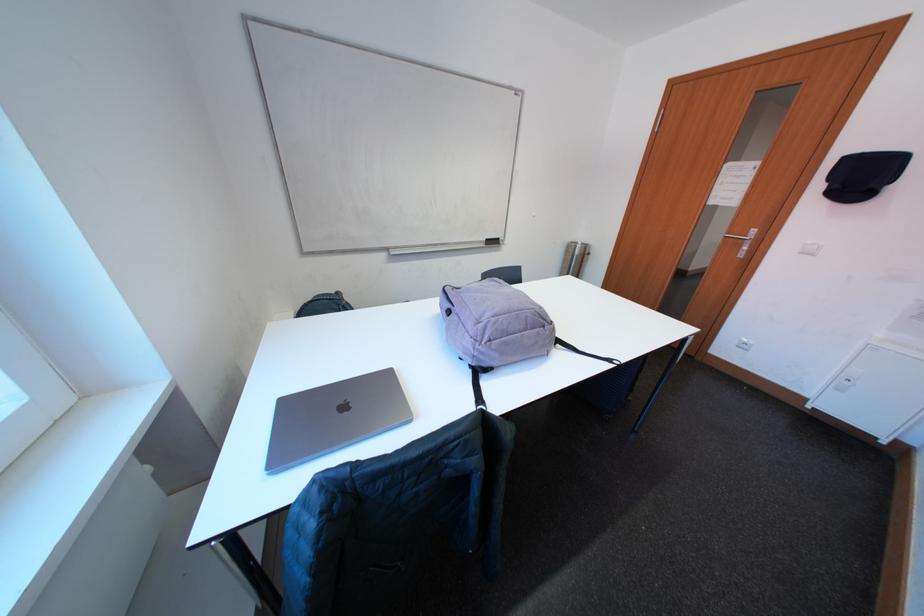
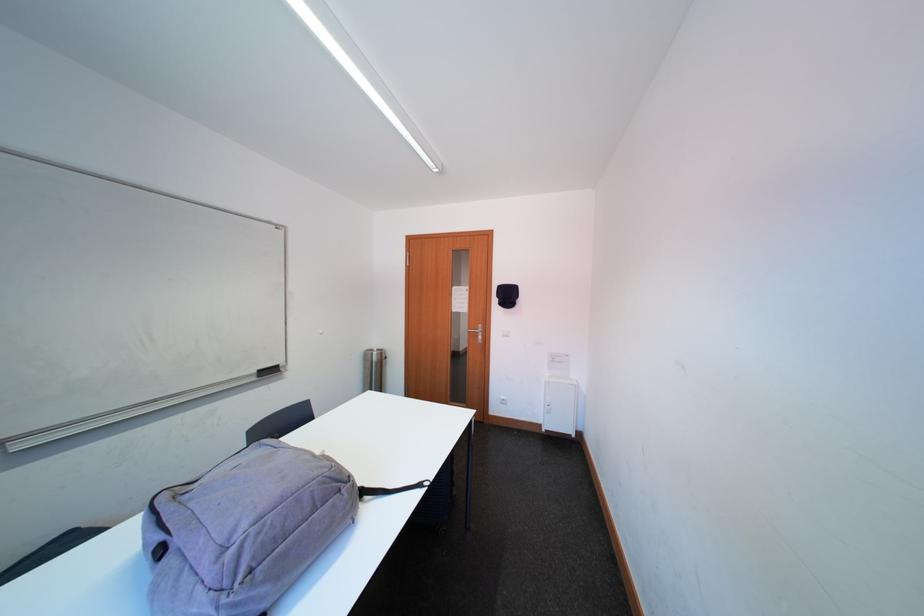
Question: The images are taken continuously from a first-person perspective. In which direction is your viewpoint rotating?

Choices:
 (A) Left
 (B) Right
 (C) Up
 (D) Down

Answer: (B)